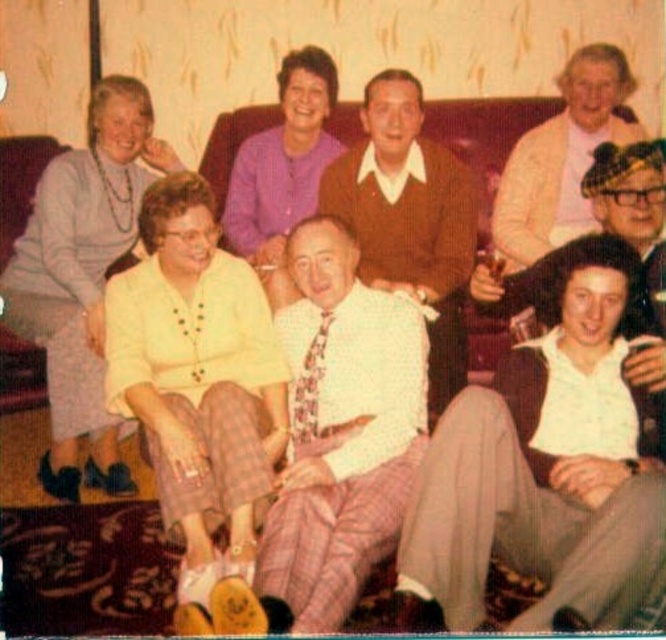
Between light yellow fabric blouse at upper left and brown sweater at center, which one appears on the right side from the viewer's perspective?

From the viewer's perspective, brown sweater at center appears more on the right side.

This screenshot has height=640, width=666. Find the location of `light yellow fabric blouse at upper left`. light yellow fabric blouse at upper left is located at coordinates (83, 276).

Does white cotton shirt at lower right appear on the right side of clear plastic cup at center right?

Indeed, white cotton shirt at lower right is positioned on the right side of clear plastic cup at center right.

Who is shorter, white cotton shirt at lower right or clear plastic cup at center right?

With less height is clear plastic cup at center right.

Between point (555, 436) and point (501, 259), which one is positioned behind?

The point (501, 259) is more distant.

The image size is (666, 640). Find the location of `white cotton shirt at lower right`. white cotton shirt at lower right is located at coordinates (543, 468).

Is the position of light yellow fabric blouse at upper left more distant than that of purple knitwear at upper center?

That is False.

What do you see at coordinates (83, 276) in the screenshot? The image size is (666, 640). I see `light yellow fabric blouse at upper left` at bounding box center [83, 276].

Locate an element on the screen. This screenshot has height=640, width=666. light yellow fabric blouse at upper left is located at coordinates (83, 276).